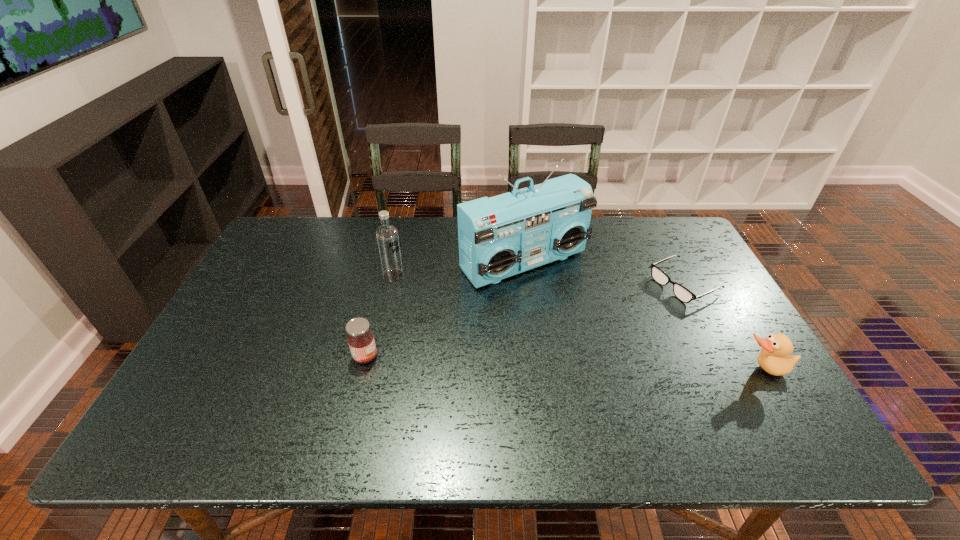
You are a GUI agent. You are given a task and a screenshot of the screen. Output one action in this format:
    pyautogui.click(x=<x>, y=<y>)
    Task: Click on the jam
    Image resolution: width=960 pixels, height=540 pixels.
    Given the screenshot: What is the action you would take?
    pyautogui.click(x=361, y=341)

Locate an element on the screen. Image resolution: width=960 pixels, height=540 pixels. duck is located at coordinates (773, 358).

I want to click on the second tallest object, so click(x=387, y=237).

Find the location of a particular element. radio receiver is located at coordinates (501, 236).

In order to click on the tallest object in this screenshot , I will do `click(501, 236)`.

Identify the location of spectacles. The height and width of the screenshot is (540, 960). (682, 293).

Find the location of `free space located on the label side of the jam`. free space located on the label side of the jam is located at coordinates (490, 356).

Identify the location of vacant region located 0.060m on the beak of the duck. (782, 402).

Where is `vacant region located on the front label of the second tallest object`? The image size is (960, 540). vacant region located on the front label of the second tallest object is located at coordinates (497, 334).

Where is `vacant region located 0.100m on the front label of the second tallest object`? The height and width of the screenshot is (540, 960). vacant region located 0.100m on the front label of the second tallest object is located at coordinates (427, 294).